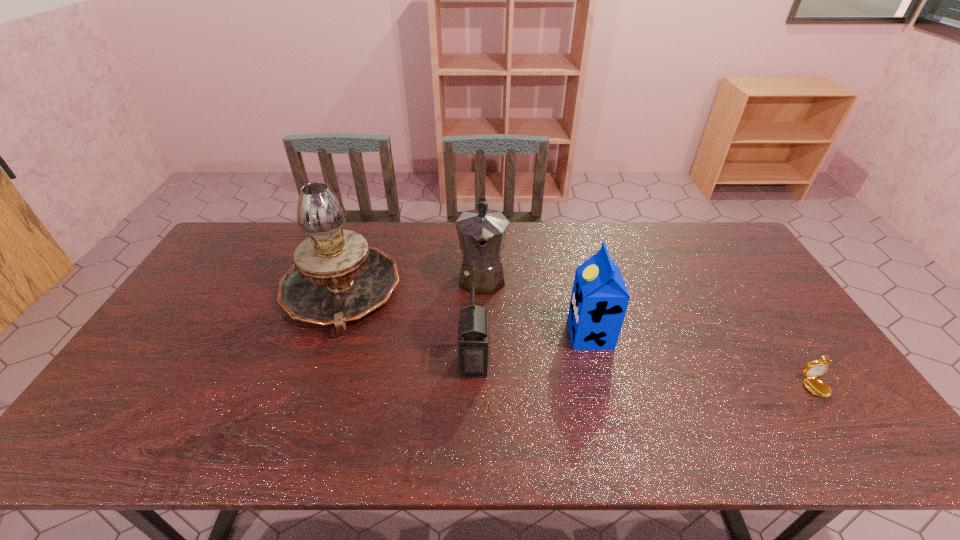
At what (x,y) coordinates should I click in order to perform the action: click on the leftmost object. Please return your answer as a coordinate pair (x, y). This screenshot has height=540, width=960. Looking at the image, I should click on (335, 277).

What are the coordinates of `oil lamp` in the screenshot? It's located at (335, 277).

Find the location of `coffeepot`. coffeepot is located at coordinates (482, 232).

Image resolution: width=960 pixels, height=540 pixels. What are the coordinates of `the second object from right to left` in the screenshot? It's located at (599, 300).

Identify the location of the second shortest object. (473, 338).

Locate an element on the screen. The width and height of the screenshot is (960, 540). the shortest object is located at coordinates (815, 368).

Find the location of a particular element. This screenshot has width=960, height=540. the rightmost object is located at coordinates (815, 368).

The height and width of the screenshot is (540, 960). I want to click on free space located 0.080m on the left of the tallest object, so click(254, 292).

The width and height of the screenshot is (960, 540). Find the location of `blank space located 0.070m on the pouring side of the coffeepot`. blank space located 0.070m on the pouring side of the coffeepot is located at coordinates (482, 320).

Locate an element on the screen. This screenshot has width=960, height=540. vacant region located with the cap open on the carton is located at coordinates (460, 334).